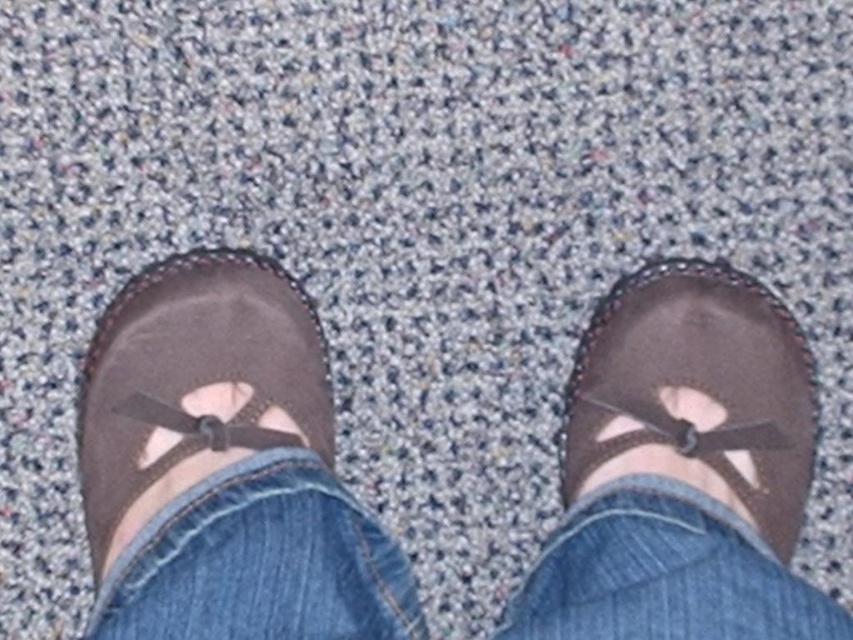
Where are the brown suede shoes at center located in the image?

The brown suede shoes at center are located at point (224, 467) in the image.

You are a fashion designer analyzing the placement of clothing in the image. Where is the denim at center located in terms of coordinates?

The denim at center is located at point coordinates of [260,563].